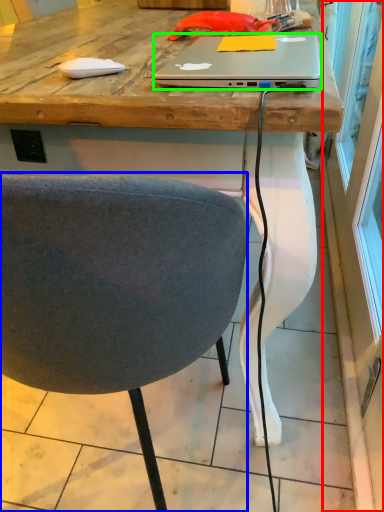
Question: Which object is the closest to the screen door (highlighted by a red box)? Choose among these: chair (highlighted by a blue box) or laptop (highlighted by a green box).

Choices:
 (A) chair
 (B) laptop

Answer: (A)